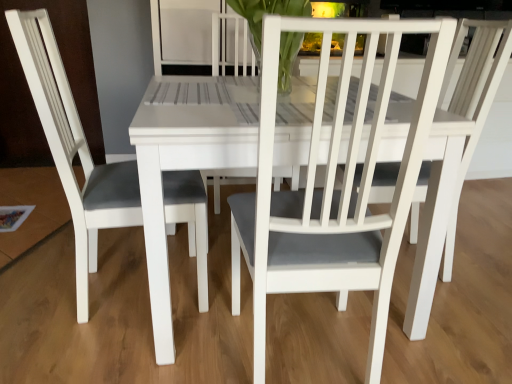
Question: In terms of size, does white matte chair at center, which ranks as the second chair in left-to-right order, appear bigger or smaller than clear glass vase at center?

Choices:
 (A) small
 (B) big

Answer: (B)

Question: From a real-world perspective, is white matte chair at center, which is the first chair from right to left, positioned above or below clear glass vase at center?

Choices:
 (A) below
 (B) above

Answer: (A)

Question: Which object is positioned farthest from the clear glass vase at center?

Choices:
 (A) white matte chair at center, which ranks as the second chair in left-to-right order
 (B) white matte chair at left, the second chair positioned from the right

Answer: (A)

Question: Which object is positioned farthest from the white matte chair at center, which is the first chair from right to left?

Choices:
 (A) white matte chair at left, placed as the 1th chair when sorted from left to right
 (B) clear glass vase at center

Answer: (B)